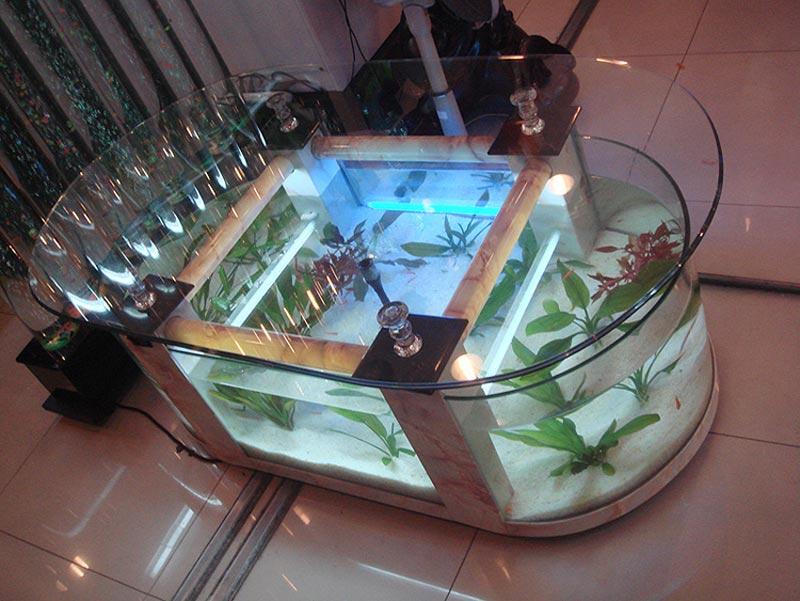
You are a GUI agent. You are given a task and a screenshot of the screen. Output one action in this format:
    pyautogui.click(x=<x>, y=<y>)
    Task: Click on the glass top of table
    
    Given the screenshot: What is the action you would take?
    pyautogui.click(x=457, y=252)